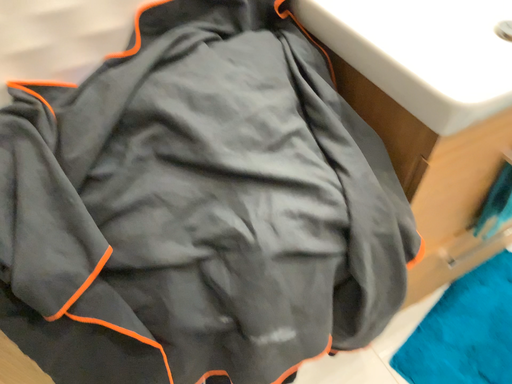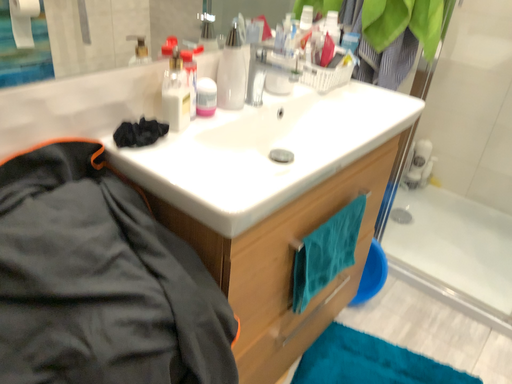
Question: How did the camera likely rotate when shooting the video?

Choices:
 (A) rotated upward
 (B) rotated downward

Answer: (A)